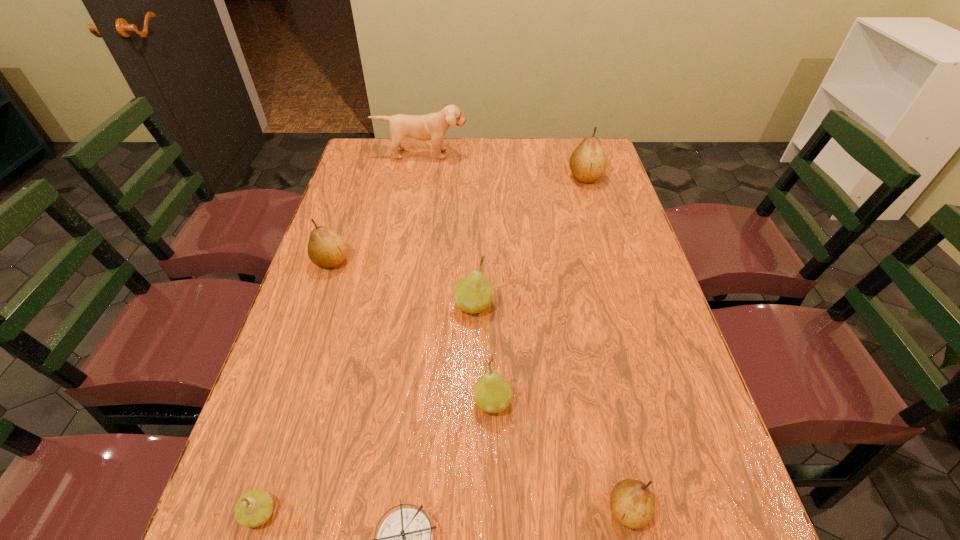
You are a GUI agent. You are given a task and a screenshot of the screen. Output one action in this format:
    pyautogui.click(x=<x>, y=<y>)
    Task: Click on the smallest green pear
    
    Given the screenshot: What is the action you would take?
    pyautogui.click(x=253, y=509)

The width and height of the screenshot is (960, 540). In order to click on the leftmost green pear in this screenshot , I will do `click(253, 509)`.

This screenshot has width=960, height=540. Find the location of `the second brown pear from left to right`. the second brown pear from left to right is located at coordinates (632, 504).

Locate an element on the screen. The height and width of the screenshot is (540, 960). the nearest brown pear is located at coordinates (632, 504).

You are a GUI agent. You are given a task and a screenshot of the screen. Output one action in this format:
    pyautogui.click(x=<x>, y=<y>)
    Task: Click on the vacant space located 0.360m on the left side of the puppy
    
    Given the screenshot: What is the action you would take?
    pyautogui.click(x=409, y=225)

At what (x,y) coordinates should I click in order to perform the action: click on free spot located 0.370m on the front of the seventh nearest object. Please return your answer as a coordinate pair (x, y). Looking at the image, I should click on pyautogui.click(x=612, y=266).

At what (x,y) coordinates should I click in order to perform the action: click on vacant region located 0.060m on the front of the farthest green pear. Please return your answer as a coordinate pair (x, y). The image size is (960, 540). Looking at the image, I should click on (473, 341).

The height and width of the screenshot is (540, 960). Find the location of `vacant space located on the front of the third farthest object`. vacant space located on the front of the third farthest object is located at coordinates (312, 317).

The image size is (960, 540). What are the coordinates of `free region located 0.200m on the front of the second biggest green pear` in the screenshot? It's located at (495, 530).

This screenshot has width=960, height=540. I want to click on free spot located 0.330m on the right of the nearest green pear, so click(465, 513).